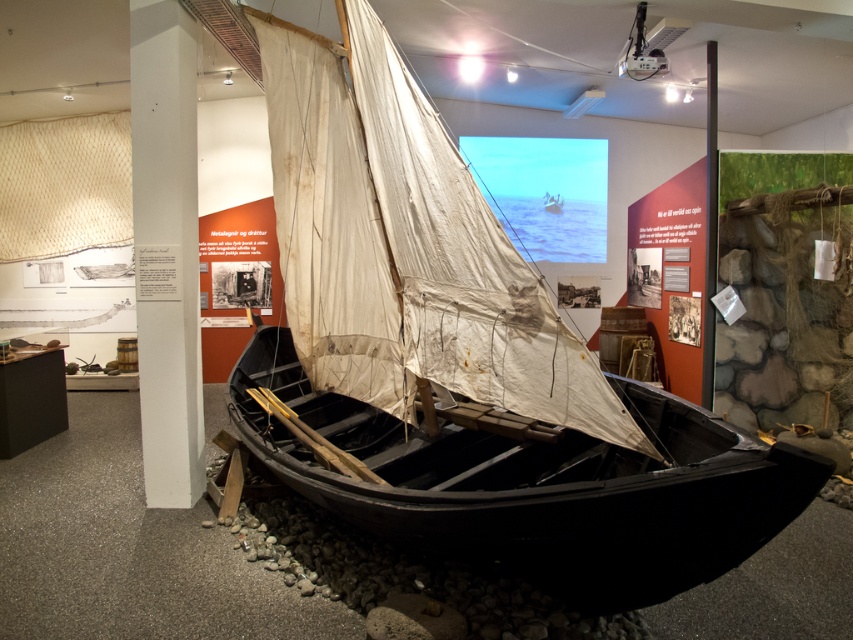
Question: Can you confirm if white canvas sail at center is thinner than black polished wood canoe at center?

Choices:
 (A) yes
 (B) no

Answer: (A)

Question: Which point is farther to the camera?

Choices:
 (A) white canvas sail at center
 (B) black polished wood canoe at center

Answer: (A)

Question: Among these points, which one is nearest to the camera?

Choices:
 (A) (339, 163)
 (B) (686, 500)

Answer: (B)

Question: Does white canvas sail at center have a larger size compared to black polished wood canoe at center?

Choices:
 (A) no
 (B) yes

Answer: (A)

Question: Among these points, which one is nearest to the camera?

Choices:
 (A) (438, 506)
 (B) (323, 124)

Answer: (A)

Question: Can you confirm if white canvas sail at center is bigger than black polished wood canoe at center?

Choices:
 (A) yes
 (B) no

Answer: (B)